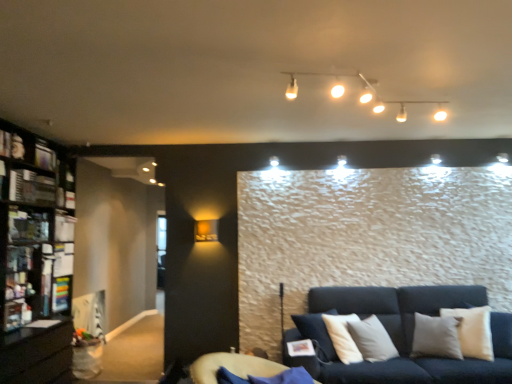
This screenshot has height=384, width=512. Find the location of `metallic silver shelf at left, the first shelf in the top-to-bottom sequence`. metallic silver shelf at left, the first shelf in the top-to-bottom sequence is located at coordinates (32, 188).

Where is `matte gold wall sconce at upper left, which is counted as the first lamp, starting from the bottom`? This screenshot has width=512, height=384. matte gold wall sconce at upper left, which is counted as the first lamp, starting from the bottom is located at coordinates (206, 230).

Measure the distance between point (278, 366) and camera.

The depth of point (278, 366) is 10.72 feet.

Measure the distance between point (56, 288) and camera.

A: A distance of 4.40 meters exists between point (56, 288) and camera.

Image resolution: width=512 pixels, height=384 pixels. What do you see at coordinates (61, 294) in the screenshot?
I see `matte black shelf at left, placed as the first shelf when sorted from back to front` at bounding box center [61, 294].

Where is `white glossy track lights at upper center, which is the 2th lamp from bottom to top`? white glossy track lights at upper center, which is the 2th lamp from bottom to top is located at coordinates (368, 95).

You are a GUI agent. You are given a task and a screenshot of the screen. Output one action in this format:
    pyautogui.click(x=<x>, y=<y>)
    Task: Click on the metallic silver shelf at left, arranged as the 2th shelf when viewed from the back
    This screenshot has width=512, height=384.
    Given the screenshot: What is the action you would take?
    32,188

Which is in front, point (23, 199) or point (216, 235)?

Positioned in front is point (23, 199).

Considering the sizes of objects metallic silver shelf at left, positioned as the second shelf in bottom-to-top order, and matte gold wall sconce at upper left, which is counted as the first lamp, starting from the bottom, in the image provided, who is bigger, metallic silver shelf at left, positioned as the second shelf in bottom-to-top order, or matte gold wall sconce at upper left, which is counted as the first lamp, starting from the bottom,?

metallic silver shelf at left, positioned as the second shelf in bottom-to-top order.

Is metallic silver shelf at left, the first shelf from the front, next to matte gold wall sconce at upper left, the 2th lamp when ordered from right to left?

There is a gap between metallic silver shelf at left, the first shelf from the front, and matte gold wall sconce at upper left, the 2th lamp when ordered from right to left.

Which object is further away from the camera, metallic silver shelf at left, the first shelf in the top-to-bottom sequence, or matte gold wall sconce at upper left, the 2th lamp when ordered from right to left?

Positioned behind is matte gold wall sconce at upper left, the 2th lamp when ordered from right to left.

Is matte black shelf at left, which is the second shelf from top to bottom, oriented towards matte gold wall sconce at upper left, the 2th lamp when ordered from right to left?

Yes, matte black shelf at left, which is the second shelf from top to bottom, faces towards matte gold wall sconce at upper left, the 2th lamp when ordered from right to left.

Does matte black shelf at left, the second shelf from the front, have a greater width compared to matte gold wall sconce at upper left, which is counted as the first lamp, starting from the bottom?

Yes, matte black shelf at left, the second shelf from the front, is wider than matte gold wall sconce at upper left, which is counted as the first lamp, starting from the bottom.

Choose the correct answer: Is matte black shelf at left, which is counted as the first shelf, starting from the bottom, inside matte gold wall sconce at upper left, the 2th lamp when ordered from right to left, or outside it?

matte black shelf at left, which is counted as the first shelf, starting from the bottom, is outside matte gold wall sconce at upper left, the 2th lamp when ordered from right to left.

From the picture: Between metallic silver shelf at left, the first shelf in the top-to-bottom sequence, and velvet blue futon at lower center, which one has smaller width?

metallic silver shelf at left, the first shelf in the top-to-bottom sequence.

From a real-world perspective, who is located higher, metallic silver shelf at left, arranged as the 2th shelf when viewed from the back, or velvet blue futon at lower center?

metallic silver shelf at left, arranged as the 2th shelf when viewed from the back, from a real-world perspective.

How different are the orientations of metallic silver shelf at left, the first shelf in the top-to-bottom sequence, and velvet blue futon at lower center in degrees?

metallic silver shelf at left, the first shelf in the top-to-bottom sequence, and velvet blue futon at lower center are facing 79 degrees away from each other.

Is metallic silver shelf at left, positioned as the second shelf in bottom-to-top order, completely or partially outside of velvet blue futon at lower center?

That's correct, metallic silver shelf at left, positioned as the second shelf in bottom-to-top order, is outside of velvet blue futon at lower center.

Who is taller, matte black shelf at left, which is counted as the first shelf, starting from the bottom, or metallic silver shelf at left, arranged as the 2th shelf when viewed from the back?

matte black shelf at left, which is counted as the first shelf, starting from the bottom, is taller.

In the image, is matte black shelf at left, which is counted as the first shelf, starting from the bottom, positioned in front of or behind metallic silver shelf at left, the first shelf from the front?

matte black shelf at left, which is counted as the first shelf, starting from the bottom, is positioned farther from the viewer than metallic silver shelf at left, the first shelf from the front.

Looking at this image, which is correct: matte black shelf at left, which is counted as the first shelf, starting from the bottom, is inside metallic silver shelf at left, the first shelf from the front, or outside of it?

matte black shelf at left, which is counted as the first shelf, starting from the bottom, is located beyond the bounds of metallic silver shelf at left, the first shelf from the front.

From a real-world perspective, relative to metallic silver shelf at left, positioned as the second shelf in bottom-to-top order, is matte black shelf at left, the second shelf from the front, vertically above or below?

matte black shelf at left, the second shelf from the front, is below metallic silver shelf at left, positioned as the second shelf in bottom-to-top order.

Who is taller, matte gold wall sconce at upper left, the 2th lamp from the top, or white glossy track lights at upper center, marked as the first lamp in a front-to-back arrangement?

With more height is matte gold wall sconce at upper left, the 2th lamp from the top.

Considering the relative positions of matte gold wall sconce at upper left, which ranks as the 1th lamp in left-to-right order, and white glossy track lights at upper center, which is the 2th lamp from bottom to top, in the image provided, is matte gold wall sconce at upper left, which ranks as the 1th lamp in left-to-right order, in front of white glossy track lights at upper center, which is the 2th lamp from bottom to top,?

No, matte gold wall sconce at upper left, which ranks as the 1th lamp in left-to-right order, is further to the viewer.

In the scene shown: Is matte gold wall sconce at upper left, which is counted as the first lamp, starting from the bottom, directly adjacent to white glossy track lights at upper center, which is the 1th lamp in top-to-bottom order?

No, matte gold wall sconce at upper left, which is counted as the first lamp, starting from the bottom, is not in contact with white glossy track lights at upper center, which is the 1th lamp in top-to-bottom order.

Considering the positions of points (293, 87) and (16, 245), is point (293, 87) closer to camera compared to point (16, 245)?

Yes, it is.

Between white glossy track lights at upper center, positioned as the second lamp in back-to-front order, and black wooden bookcase at left, which one has smaller width?

white glossy track lights at upper center, positioned as the second lamp in back-to-front order.

From a real-world perspective, between white glossy track lights at upper center, which is the 1th lamp in top-to-bottom order, and black wooden bookcase at left, who is vertically lower?

black wooden bookcase at left, from a real-world perspective.

Which of these two, white glossy track lights at upper center, which is the 1th lamp in top-to-bottom order, or black wooden bookcase at left, is bigger?

Bigger between the two is black wooden bookcase at left.

Between point (202, 227) and point (23, 188), which one is positioned in front?

The point (23, 188) is closer.

Does matte gold wall sconce at upper left, the 2th lamp from the top, turn towards metallic silver shelf at left, the first shelf from the front?

No, matte gold wall sconce at upper left, the 2th lamp from the top, is not turned towards metallic silver shelf at left, the first shelf from the front.

Can you tell me how much matte gold wall sconce at upper left, the 2th lamp from the top, and metallic silver shelf at left, arranged as the 2th shelf when viewed from the back, differ in facing direction?

The facing directions of matte gold wall sconce at upper left, the 2th lamp from the top, and metallic silver shelf at left, arranged as the 2th shelf when viewed from the back, are 88.4 degrees apart.

How far apart are matte gold wall sconce at upper left, the 2th lamp from the top, and metallic silver shelf at left, positioned as the second shelf in bottom-to-top order?

5.49 feet.

Find the location of `lamp located underneath the metallic silver shelf at left, arranged as the 2th shelf when viewed from the back (from a real-world perspective)`. lamp located underneath the metallic silver shelf at left, arranged as the 2th shelf when viewed from the back (from a real-world perspective) is located at coordinates (206, 230).

From the matte gold wall sconce at upper left, which ranks as the 1th lamp in left-to-right order, count 1st shelfs forward and point to it. Please provide its 2D coordinates.

[(61, 294)]

From the image, which object appears to be farther from metallic silver shelf at left, arranged as the 2th shelf when viewed from the back, black wooden bookcase at left or matte gold wall sconce at upper left, positioned as the second lamp in front-to-back order?

The object further to metallic silver shelf at left, arranged as the 2th shelf when viewed from the back, is matte gold wall sconce at upper left, positioned as the second lamp in front-to-back order.

Which object lies nearer to the anchor point velvet blue futon at lower center, matte gold wall sconce at upper left, which is counted as the first lamp, starting from the bottom, or metallic silver shelf at left, positioned as the second shelf in bottom-to-top order?

matte gold wall sconce at upper left, which is counted as the first lamp, starting from the bottom.

Based on the photo, considering their positions, is matte black shelf at left, the second shelf from the front, positioned closer to velvet blue futon at lower center than black wooden bookcase at left?

Among the two, black wooden bookcase at left is located nearer to velvet blue futon at lower center.

From the picture: Which object lies further to the anchor point metallic silver shelf at left, positioned as the second shelf in bottom-to-top order, white glossy track lights at upper center, which is the 2th lamp from bottom to top, or matte gold wall sconce at upper left, which is counted as the first lamp, starting from the bottom?

white glossy track lights at upper center, which is the 2th lamp from bottom to top.

Which object lies further to the anchor point white glossy track lights at upper center, which is the 1th lamp in top-to-bottom order, velvet blue futon at lower center or metallic silver shelf at left, the first shelf from the front?

metallic silver shelf at left, the first shelf from the front, lies further to white glossy track lights at upper center, which is the 1th lamp in top-to-bottom order, than the other object.

Based on the photo, considering their positions, is metallic silver shelf at left, the first shelf in the top-to-bottom sequence, positioned further to matte gold wall sconce at upper left, the 2th lamp when ordered from right to left, than matte black shelf at left, which is counted as the first shelf, starting from the bottom?

metallic silver shelf at left, the first shelf in the top-to-bottom sequence, is further to matte gold wall sconce at upper left, the 2th lamp when ordered from right to left.

When comparing their distances from white glossy track lights at upper center, which is the 2th lamp from bottom to top, does velvet blue futon at lower center or black wooden bookcase at left seem further?

Based on the image, black wooden bookcase at left appears to be further to white glossy track lights at upper center, which is the 2th lamp from bottom to top.

Considering their positions, is matte black shelf at left, the second shelf from the front, positioned further to white glossy track lights at upper center, which ranks as the first lamp in right-to-left order, than velvet blue futon at lower center?

matte black shelf at left, the second shelf from the front, is further to white glossy track lights at upper center, which ranks as the first lamp in right-to-left order.

At what (x,y) coordinates should I click in order to perform the action: click on lamp situated between matte black shelf at left, placed as the first shelf when sorted from back to front, and white glossy track lights at upper center, the second lamp in the left-to-right sequence, from left to right. Please return your answer as a coordinate pair (x, y). This screenshot has width=512, height=384. Looking at the image, I should click on (206, 230).

I want to click on bookcase between matte black shelf at left, which is the second shelf from top to bottom, and white glossy track lights at upper center, positioned as the second lamp in back-to-front order, from left to right, so click(x=34, y=256).

The image size is (512, 384). I want to click on lamp situated between black wooden bookcase at left and white glossy track lights at upper center, which is the 1th lamp in top-to-bottom order, from left to right, so click(x=206, y=230).

The height and width of the screenshot is (384, 512). Identify the location of bookcase located between metallic silver shelf at left, the first shelf from the front, and white glossy track lights at upper center, the second lamp in the left-to-right sequence, in the left-right direction. click(x=34, y=256).